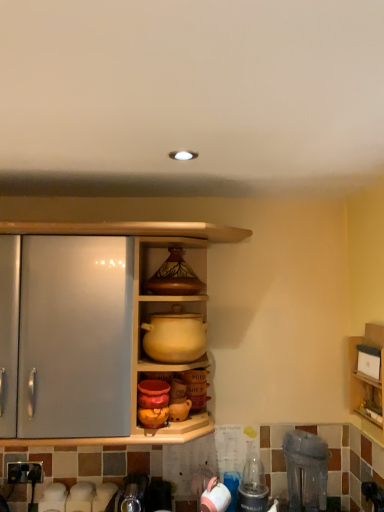
Question: Does matte ceramic vase at upper center come in front of wooden shelf at right, acting as the second shelf starting from the left?

Choices:
 (A) no
 (B) yes

Answer: (A)

Question: Is matte ceramic vase at upper center aimed at wooden shelf at right, acting as the second shelf starting from the left?

Choices:
 (A) no
 (B) yes

Answer: (A)

Question: From a real-world perspective, is matte ceramic vase at upper center positioned under wooden shelf at right, acting as the second shelf starting from the left, based on gravity?

Choices:
 (A) no
 (B) yes

Answer: (A)

Question: Considering the relative positions of matte ceramic vase at upper center and wooden shelf at right, acting as the 1th shelf starting from the right, in the image provided, is matte ceramic vase at upper center to the left of wooden shelf at right, acting as the 1th shelf starting from the right, from the viewer's perspective?

Choices:
 (A) no
 (B) yes

Answer: (B)

Question: From the image's perspective, would you say matte ceramic vase at upper center is positioned over wooden shelf at right, acting as the 1th shelf starting from the right?

Choices:
 (A) no
 (B) yes

Answer: (B)

Question: From a real-world perspective, is clear plastic bottle at lower right above or below white glossy kettle at lower center, the second appliance from the right?

Choices:
 (A) above
 (B) below

Answer: (B)

Question: From the image's perspective, is clear plastic bottle at lower right above or below white glossy kettle at lower center, which is the first appliance from left to right?

Choices:
 (A) above
 (B) below

Answer: (B)

Question: In terms of height, does clear plastic bottle at lower right look taller or shorter compared to white glossy kettle at lower center, which is the first appliance from left to right?

Choices:
 (A) short
 (B) tall

Answer: (B)

Question: Is point (236, 502) positioned closer to the camera than point (206, 510)?

Choices:
 (A) farther
 (B) closer

Answer: (A)

Question: From the image's perspective, is wooden shelf at right, acting as the second shelf starting from the left, positioned above or below transparent plastic blender at lower right, arranged as the first appliance when viewed from the right?

Choices:
 (A) below
 (B) above

Answer: (B)

Question: Is wooden shelf at right, acting as the second shelf starting from the left, inside the boundaries of transparent plastic blender at lower right, the second appliance when ordered from left to right, or outside?

Choices:
 (A) outside
 (B) inside

Answer: (A)

Question: Would you say wooden shelf at right, acting as the 1th shelf starting from the right, is to the left or to the right of transparent plastic blender at lower right, the second appliance when ordered from left to right, in the picture?

Choices:
 (A) left
 (B) right

Answer: (B)

Question: From their relative heights in the image, would you say wooden shelf at right, acting as the 1th shelf starting from the right, is taller or shorter than transparent plastic blender at lower right, the second appliance when ordered from left to right?

Choices:
 (A) tall
 (B) short

Answer: (A)

Question: Is transparent plastic blender at lower right, arranged as the first appliance when viewed from the right, situated inside wooden shelf at right, acting as the 1th shelf starting from the right, or outside?

Choices:
 (A) outside
 (B) inside

Answer: (A)

Question: Is point (309, 443) positioned closer to the camera than point (374, 432)?

Choices:
 (A) closer
 (B) farther

Answer: (A)